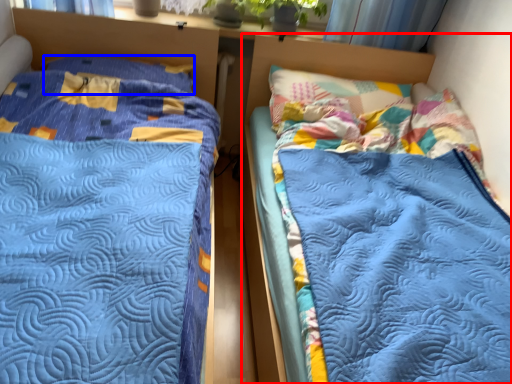
Question: Which point is further to the camera, bed (highlighted by a red box) or pillow (highlighted by a blue box)?

Choices:
 (A) bed
 (B) pillow

Answer: (B)